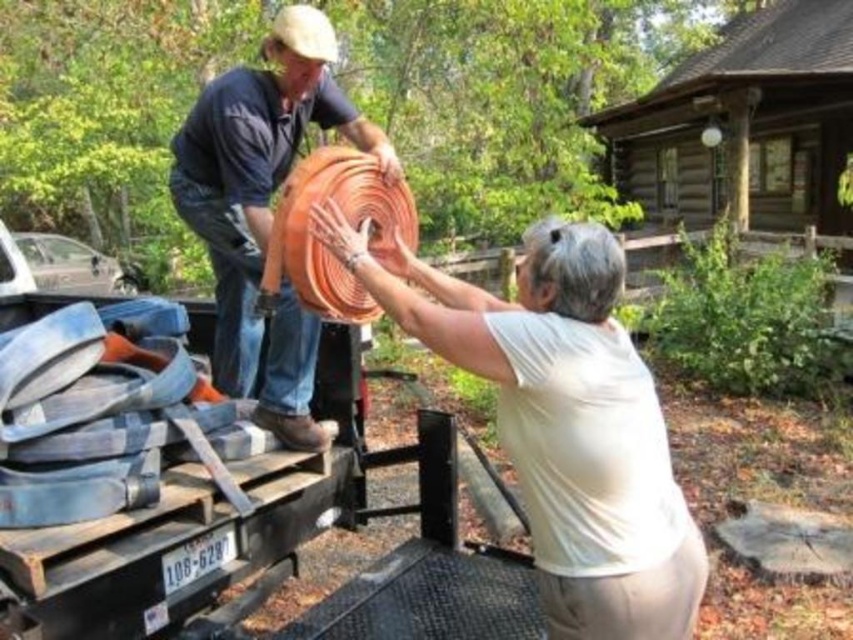
Question: Which of the following is the farthest from the observer?

Choices:
 (A) brown wooden log cabin at upper center
 (B) orange rubber hose at center

Answer: (A)

Question: Does brown wooden log cabin at upper center appear on the right side of orange rubber hose at center?

Choices:
 (A) no
 (B) yes

Answer: (B)

Question: Is brown wooden log cabin at upper center to the right of orange rubber hose at center from the viewer's perspective?

Choices:
 (A) yes
 (B) no

Answer: (A)

Question: Can you confirm if brown wooden log cabin at upper center is bigger than orange rubber hose at center?

Choices:
 (A) yes
 (B) no

Answer: (A)

Question: Which of the following is the closest to the observer?

Choices:
 (A) tap(695, 76)
 (B) tap(281, 372)

Answer: (B)